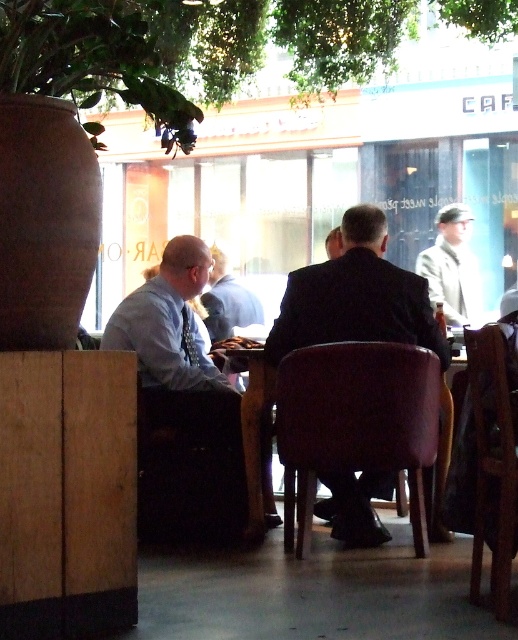
You are a photographer trying to capture a candid shot of both the light blue shirt at center and the smooth black suit at center. However, the wooden partition in the foreground might block your view. Can you adjust your position to ensure both subjects are fully visible without obstruction?

The smooth black suit at center is behind the light blue shirt at center, so adjusting your position to the side or slightly behind the light blue shirt at center would allow you to see both subjects without obstruction from the wooden partition.

You are a photographer taking a portrait of the two men at the table in the middle of the scene. The light blue shirt at center and the smooth black suit at center are both visible. Which one should you focus on to ensure the subject is in sharp focus, considering their sizes?

The light blue shirt at center is larger in size than the smooth black suit at center, so focusing on the light blue shirt at center would ensure the subject is in sharp focus due to its larger size.